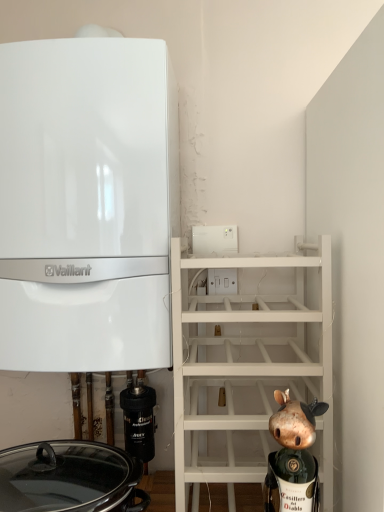
Question: From the image's perspective, would you say white glossy vaillant boiler at left is shown under black rubber filter at lower left?

Choices:
 (A) no
 (B) yes

Answer: (A)

Question: Is white glossy vaillant boiler at left not inside black rubber filter at lower left?

Choices:
 (A) yes
 (B) no

Answer: (A)

Question: Can you see white glossy vaillant boiler at left touching black rubber filter at lower left?

Choices:
 (A) yes
 (B) no

Answer: (B)

Question: Is white glossy vaillant boiler at left positioned with its back to black rubber filter at lower left?

Choices:
 (A) yes
 (B) no

Answer: (B)

Question: Does white glossy vaillant boiler at left appear on the left side of black rubber filter at lower left?

Choices:
 (A) no
 (B) yes

Answer: (B)

Question: Can you confirm if white glossy vaillant boiler at left is smaller than black rubber filter at lower left?

Choices:
 (A) no
 (B) yes

Answer: (A)

Question: Considering the relative sizes of gold metallic figurine at lower right and black rubber filter at lower left in the image provided, is gold metallic figurine at lower right bigger than black rubber filter at lower left?

Choices:
 (A) yes
 (B) no

Answer: (A)

Question: Does gold metallic figurine at lower right have a lesser height compared to black rubber filter at lower left?

Choices:
 (A) yes
 (B) no

Answer: (B)

Question: Are gold metallic figurine at lower right and black rubber filter at lower left located far from each other?

Choices:
 (A) yes
 (B) no

Answer: (B)

Question: Can you confirm if gold metallic figurine at lower right is thinner than black rubber filter at lower left?

Choices:
 (A) yes
 (B) no

Answer: (B)

Question: Does gold metallic figurine at lower right appear on the left side of black rubber filter at lower left?

Choices:
 (A) no
 (B) yes

Answer: (A)

Question: Does gold metallic figurine at lower right have a greater width compared to black rubber filter at lower left?

Choices:
 (A) yes
 (B) no

Answer: (A)

Question: Is black rubber filter at lower left wider than gold metallic figurine at lower right?

Choices:
 (A) yes
 (B) no

Answer: (B)